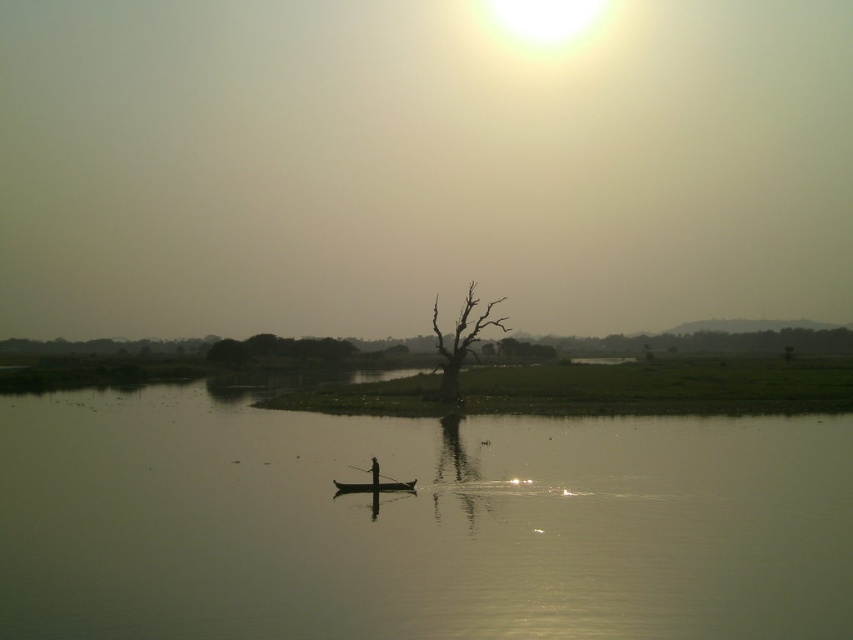
Question: Which of the following is the farthest from the observer?

Choices:
 (A) (383, 483)
 (B) (370, 470)
 (C) (351, 490)

Answer: (C)

Question: Is greenish water at center bigger than brown textured tree at center?

Choices:
 (A) yes
 (B) no

Answer: (A)

Question: Can you confirm if black wood paddle at center is bigger than wooden canoe at center?

Choices:
 (A) yes
 (B) no

Answer: (A)

Question: Estimate the real-world distances between objects in this image. Which object is farther from the silhouette wood person at center?

Choices:
 (A) wooden canoe at center
 (B) black wood paddle at center
 (C) greenish water at center
 (D) brown textured tree at center

Answer: (D)

Question: Among these points, which one is farthest from the camera?

Choices:
 (A) (467, 317)
 (B) (378, 481)

Answer: (A)

Question: Can you confirm if greenish water at center is positioned to the right of black wood paddle at center?

Choices:
 (A) yes
 (B) no

Answer: (A)